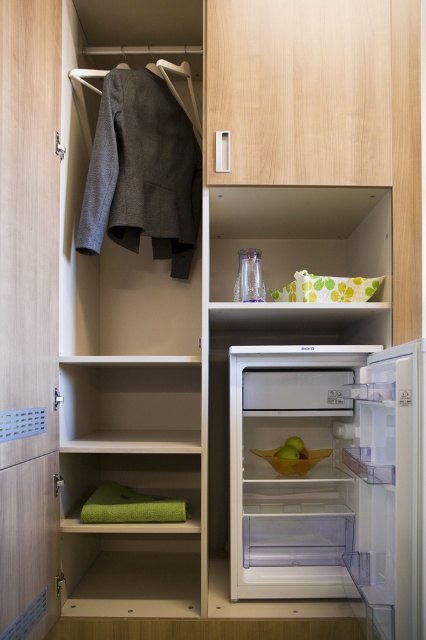
Does wooden door at left have a smaller size compared to green fabric towel at lower left?

Yes, wooden door at left is smaller than green fabric towel at lower left.

Is wooden door at left further to the viewer compared to green fabric towel at lower left?

That is False.

This screenshot has height=640, width=426. What do you see at coordinates (28, 301) in the screenshot? I see `wooden door at left` at bounding box center [28, 301].

Identify the location of wooden door at left. This screenshot has width=426, height=640. (28, 301).

Which is in front, point (175, 403) or point (284, 538)?

Point (284, 538)

Is beige wood shelf at lower left smaller than transparent plastic drawer at lower center?

Actually, beige wood shelf at lower left might be larger than transparent plastic drawer at lower center.

What do you see at coordinates (131, 403) in the screenshot? The width and height of the screenshot is (426, 640). I see `beige wood shelf at lower left` at bounding box center [131, 403].

Identify the location of beige wood shelf at lower left. (131, 403).

Find the location of `beige wood shelf at lower left`. beige wood shelf at lower left is located at coordinates (131, 403).

Does beige wood shelf at lower left appear over green fabric towel at lower left?

Yes, beige wood shelf at lower left is above green fabric towel at lower left.

This screenshot has width=426, height=640. What are the coordinates of `beige wood shelf at lower left` in the screenshot? It's located at (131, 403).